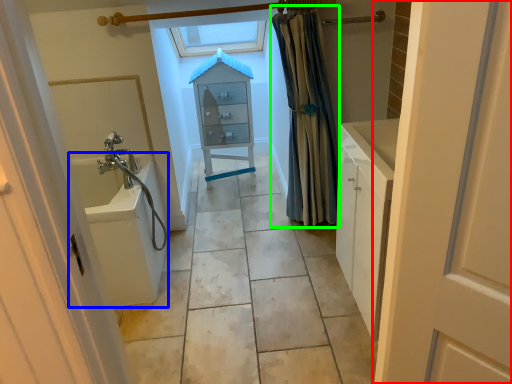
Question: Estimate the real-world distances between objects in this image. Which object is farther from door (highlighted by a red box), bath (highlighted by a blue box) or shower curtain (highlighted by a green box)?

Choices:
 (A) bath
 (B) shower curtain

Answer: (B)